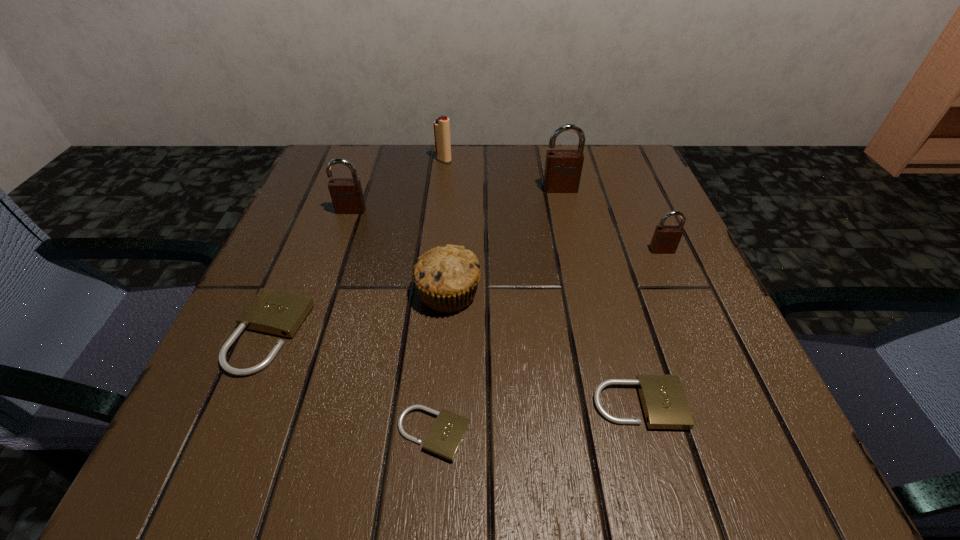
Choose which beige padlock is the second nearest neighbor to the fourth tallest padlock. Please provide its 2D coordinates. Your answer should be formatted as a tuple, i.e. [(x, y)], where the tuple contains the x and y coordinates of a point satisfying the conditions above.

[(663, 400)]

Where is `vacant region that satisfies the following two spatial constraints: 1. on the front-facing side of the shortest padlock; 2. on the right side of the second farthest brown padlock`? Image resolution: width=960 pixels, height=540 pixels. vacant region that satisfies the following two spatial constraints: 1. on the front-facing side of the shortest padlock; 2. on the right side of the second farthest brown padlock is located at coordinates (274, 434).

This screenshot has height=540, width=960. I want to click on free space that satisfies the following two spatial constraints: 1. on the back side of the second biggest beige padlock; 2. on the right side of the shortest object, so click(x=436, y=404).